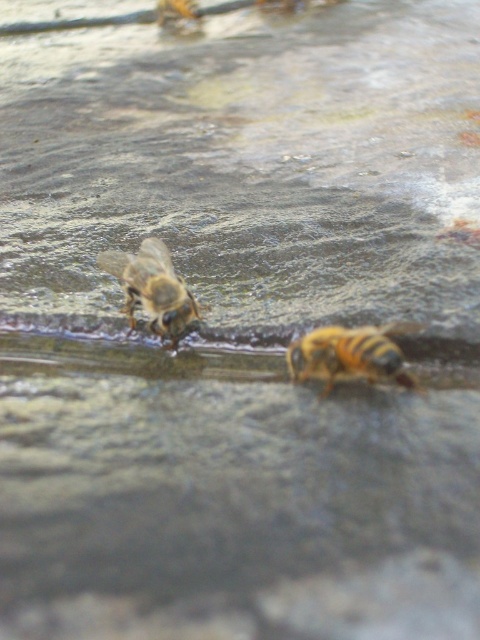
Question: Is yellow fuzzy bee at center below yellow-brown fuzzy bee at left?

Choices:
 (A) yes
 (B) no

Answer: (A)

Question: Can you confirm if yellow fuzzy bee at center is positioned above yellow-brown fuzzy bee at left?

Choices:
 (A) no
 (B) yes

Answer: (A)

Question: Which of the following is the farthest from the observer?

Choices:
 (A) yellow-brown fuzzy bee at left
 (B) yellow fuzzy bee at center

Answer: (A)

Question: Which object appears farthest from the camera in this image?

Choices:
 (A) yellow-brown fuzzy bee at left
 (B) yellow fuzzy bee at center

Answer: (A)

Question: Is yellow fuzzy bee at center closer to camera compared to yellow-brown fuzzy bee at left?

Choices:
 (A) no
 (B) yes

Answer: (B)

Question: Which object is closer to the camera taking this photo?

Choices:
 (A) yellow fuzzy bee at center
 (B) yellow-brown fuzzy bee at left

Answer: (A)